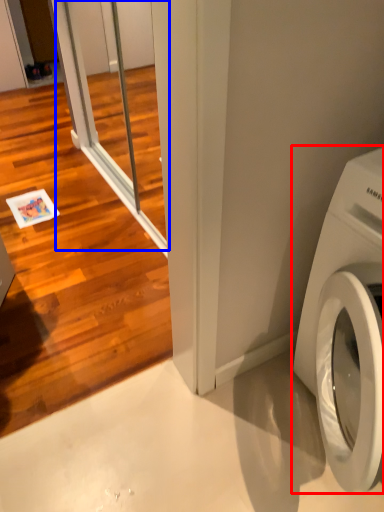
Question: Which of the following is the closest to the observer, washing machine (highlighted by a red box) or screen door (highlighted by a blue box)?

Choices:
 (A) washing machine
 (B) screen door

Answer: (A)